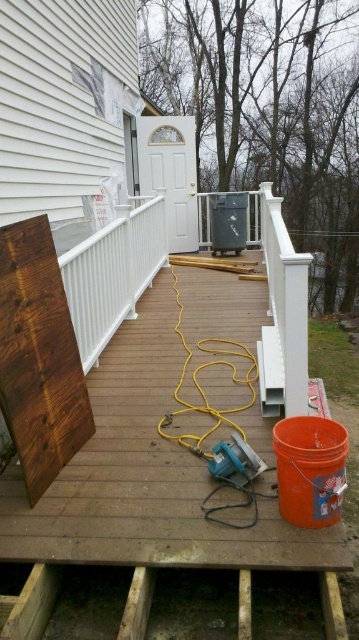
You are a contractor working on the deck. You need to move the brown wood board at left to the storage area. However, you notice the white matte rail at center might block your path. Based on the scene, can you move the board without disassembling the rail?

The brown wood board at left is in front of the white matte rail at center, meaning the board is closer to you than the rail. Since the board is already positioned in front of the rail, you can move it to the storage area without disassembling the rail as there is no obstruction from the rail in its current position.